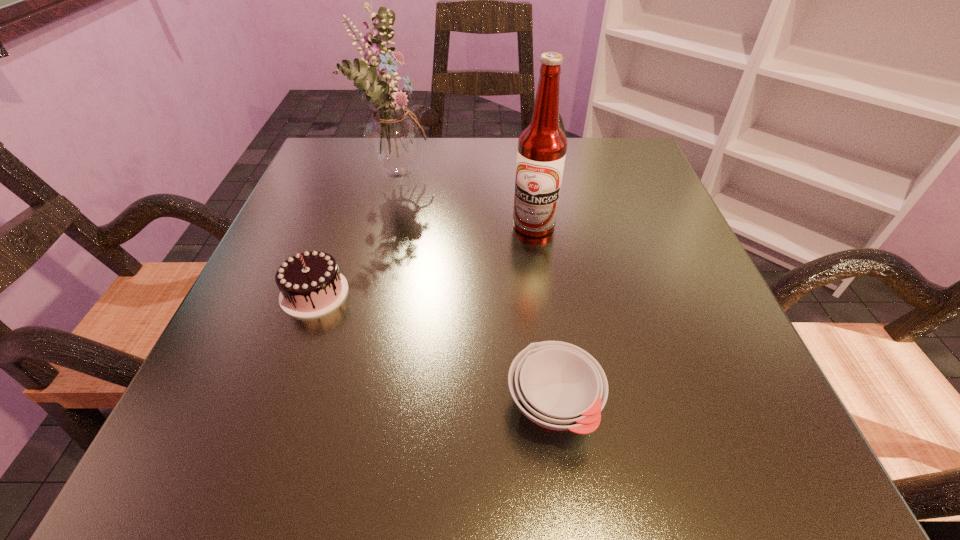
This screenshot has width=960, height=540. In the image, there is a desktop. In order to click on vacant space at the near left corner in this screenshot , I will do `click(238, 422)`.

Find the location of a particular element. The image size is (960, 540). vacant space at the far right corner of the desktop is located at coordinates (658, 193).

Locate an element on the screen. The height and width of the screenshot is (540, 960). free space at the near right corner of the desktop is located at coordinates (664, 416).

Locate an element on the screen. The height and width of the screenshot is (540, 960). free point between the alcohol and the chocolate cake is located at coordinates (424, 259).

Locate an element on the screen. This screenshot has width=960, height=540. free space between the second farthest object and the chocolate cake is located at coordinates (424, 259).

At what (x,y) coordinates should I click in order to perform the action: click on empty space that is in between the farthest object and the third nearest object. Please return your answer as a coordinate pair (x, y). Looking at the image, I should click on (468, 198).

The height and width of the screenshot is (540, 960). What are the coordinates of `free space between the farthest object and the shortest object` in the screenshot? It's located at (477, 288).

Locate an element on the screen. The width and height of the screenshot is (960, 540). free space between the third nearest object and the chocolate cake is located at coordinates (424, 259).

Find the location of `unoccupied position between the nearest object and the alcohol`. unoccupied position between the nearest object and the alcohol is located at coordinates (543, 315).

This screenshot has width=960, height=540. Identify the location of vacant area that lies between the shortest object and the alcohol. (543, 315).